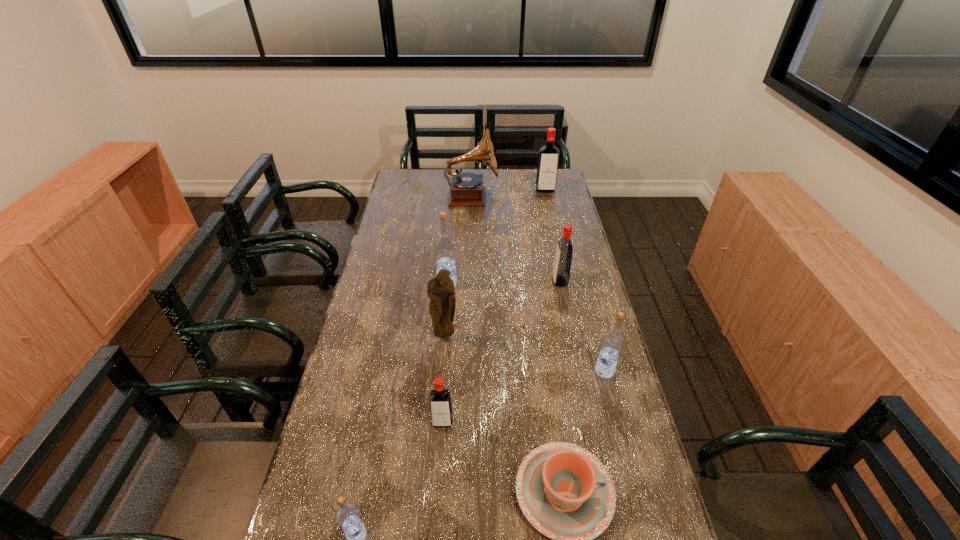
The height and width of the screenshot is (540, 960). Find the location of `phonograph_record`. phonograph_record is located at coordinates (466, 189).

Find the location of a particular element. the farthest vodka is located at coordinates (548, 158).

The width and height of the screenshot is (960, 540). What are the coordinates of `the farthest red vodka` in the screenshot? It's located at (548, 158).

You are a GUI agent. You are given a task and a screenshot of the screen. Output one action in this format:
    pyautogui.click(x=<x>, y=<y>)
    Task: Click on the second blue vodka from left to right
    The width and height of the screenshot is (960, 540).
    Given the screenshot: What is the action you would take?
    pyautogui.click(x=444, y=245)

You are a GUI agent. You are given a task and a screenshot of the screen. Output one action in this format:
    pyautogui.click(x=<x>, y=<y>)
    Task: Click on the farthest blue vodka
    This screenshot has height=540, width=960.
    Given the screenshot: What is the action you would take?
    pyautogui.click(x=444, y=245)

Identify the location of the fifth farthest object. Image resolution: width=960 pixels, height=540 pixels. (440, 289).

Identify the location of the second farthest red vodka. (562, 264).

This screenshot has height=540, width=960. What are the coordinates of `the second smallest blue vodka` in the screenshot? It's located at (613, 340).

Identify the location of the rightmost blue vodka. (613, 340).

This screenshot has height=540, width=960. What are the coordinates of `the smallest red vodka` in the screenshot? It's located at (440, 402).